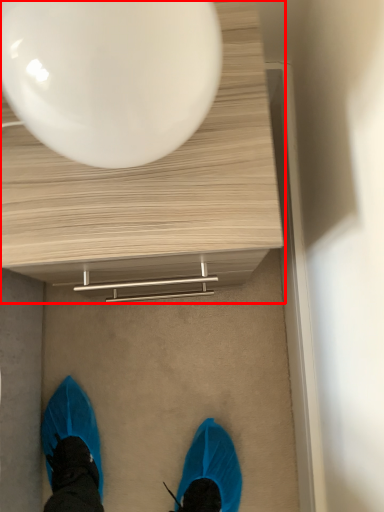
Question: From the image's perspective, what is the correct spatial relationship of table (annotated by the red box) in relation to balloon?

Choices:
 (A) below
 (B) above

Answer: (A)